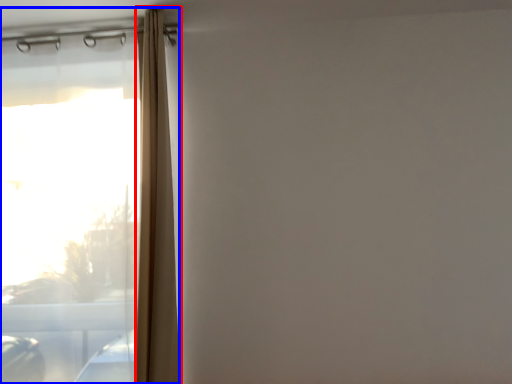
Question: Which object appears closest to the camera in this image, shower curtain (highlighted by a red box) or window (highlighted by a blue box)?

Choices:
 (A) shower curtain
 (B) window

Answer: (A)